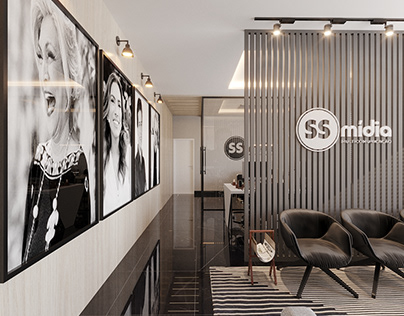
Locate an element on the screen. This screenshot has height=316, width=404. chair is located at coordinates (324, 236).